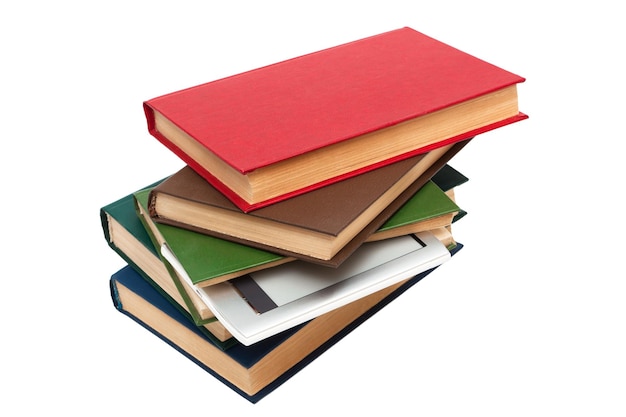
Locate an element on the screen. The image size is (626, 417). books is located at coordinates (136, 307), (128, 253), (245, 314), (203, 261), (321, 213), (279, 143).